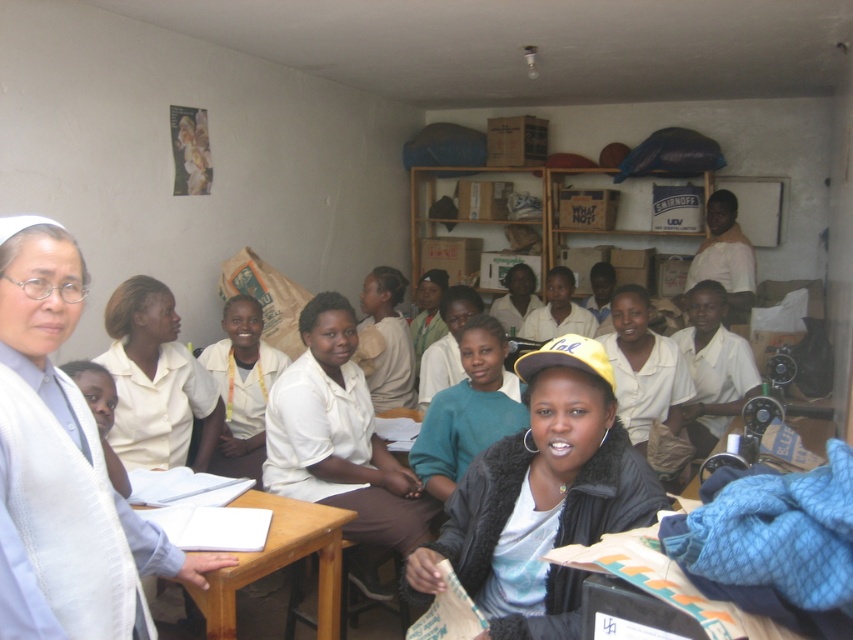
You are a photographer trying to capture a clear shot of the white matte shirt at center and the white uniform shirt at center. Which one is closer to the camera?

The white matte shirt at center is positioned under the white uniform shirt at center, so the white uniform shirt at center is closer to the camera.